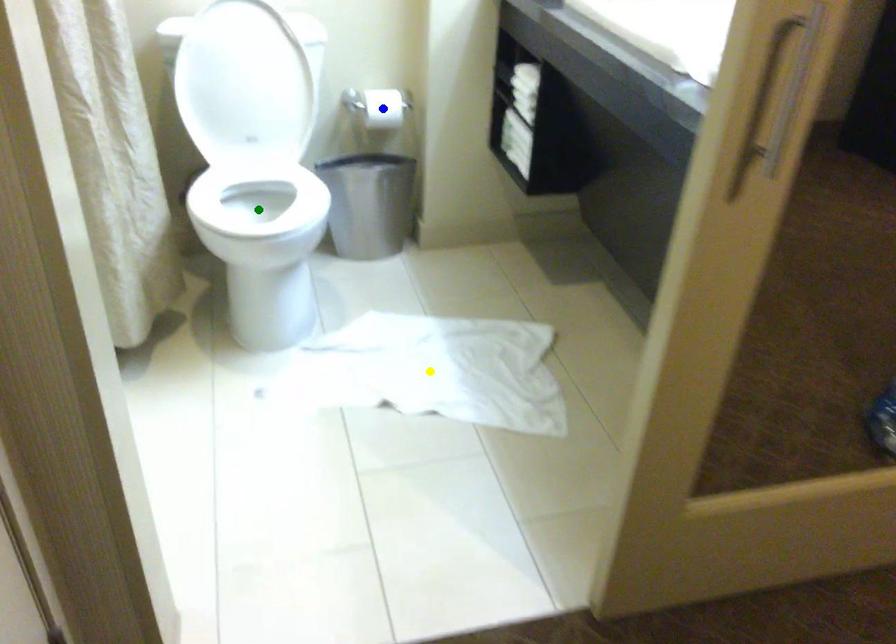
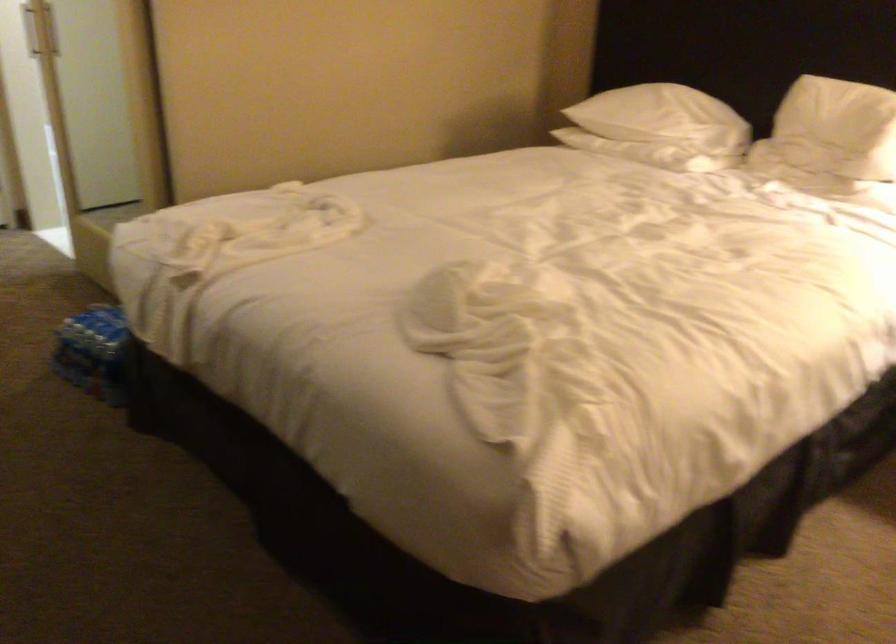
I am providing you with two images of the same scene from different viewpoints. Three points are marked in image1. Which point corresponds to a part or object that is occluded in image2?In image1, three points are marked. Which of them correspond to a part or object that is occluded in image2?Among the three points shown in image1, which one corresponds to a part or object that is no longer visible due to occlusion in image2?

yellow point, blue point, green point cannot be seen in image2.